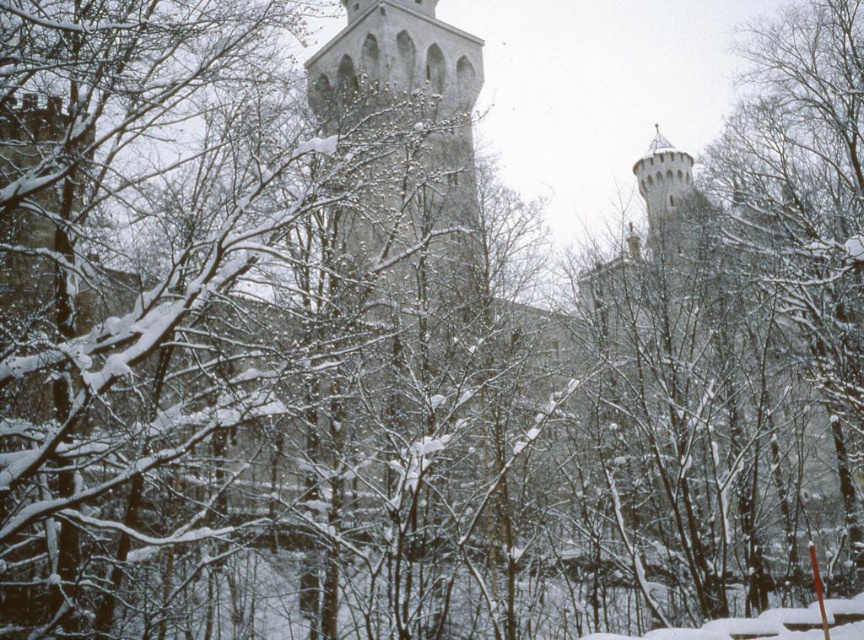
Question: Which point is farther to the camera?

Choices:
 (A) white stone tower at center
 (B) snow-covered branches at right

Answer: (A)

Question: Can you confirm if snow-covered branches at right is positioned above white stone tower at center?

Choices:
 (A) no
 (B) yes

Answer: (A)

Question: Which of the following is the farthest from the observer?

Choices:
 (A) (462, 60)
 (B) (789, 74)

Answer: (A)

Question: Does snow-covered branches at right have a greater width compared to white stone tower at center?

Choices:
 (A) no
 (B) yes

Answer: (A)

Question: Is snow-covered branches at right bigger than white stone tower at center?

Choices:
 (A) no
 (B) yes

Answer: (A)

Question: Which object appears farthest from the camera in this image?

Choices:
 (A) snow-covered branches at right
 (B) white stone tower at center

Answer: (B)